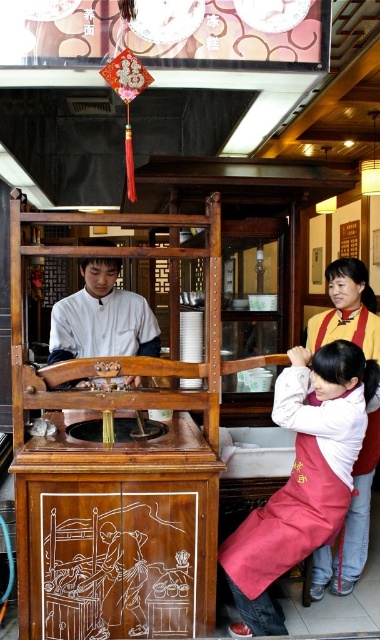
Question: Which point is farther to the camera?

Choices:
 (A) (87, 259)
 (B) (294, 426)
 (C) (368, 480)

Answer: (C)

Question: Observing the image, what is the correct spatial positioning of red apron at lower right in reference to white matte shirt at center?

Choices:
 (A) left
 (B) right

Answer: (B)

Question: Which point is closer to the camera?

Choices:
 (A) white matte shirt at center
 (B) red apron at lower right

Answer: (A)

Question: Is red apron at lower right below white matte shirt at center?

Choices:
 (A) yes
 (B) no

Answer: (A)

Question: Which point is closer to the camera taking this photo?

Choices:
 (A) (351, 330)
 (B) (231, 589)
 (C) (91, 276)

Answer: (B)

Question: Is red fabric apron at lower right above white matte shirt at center?

Choices:
 (A) no
 (B) yes

Answer: (A)